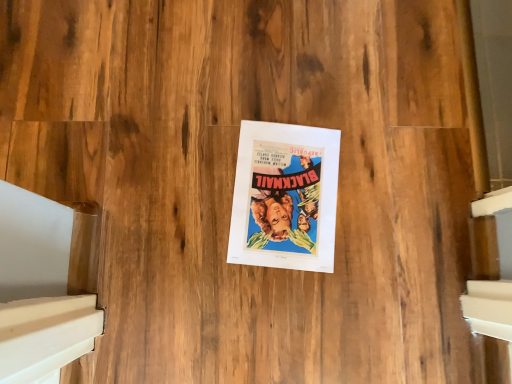
Find the location of `vacant space situated above matte paper poster at center (from a real-world perspective)`. vacant space situated above matte paper poster at center (from a real-world perspective) is located at coordinates (280, 195).